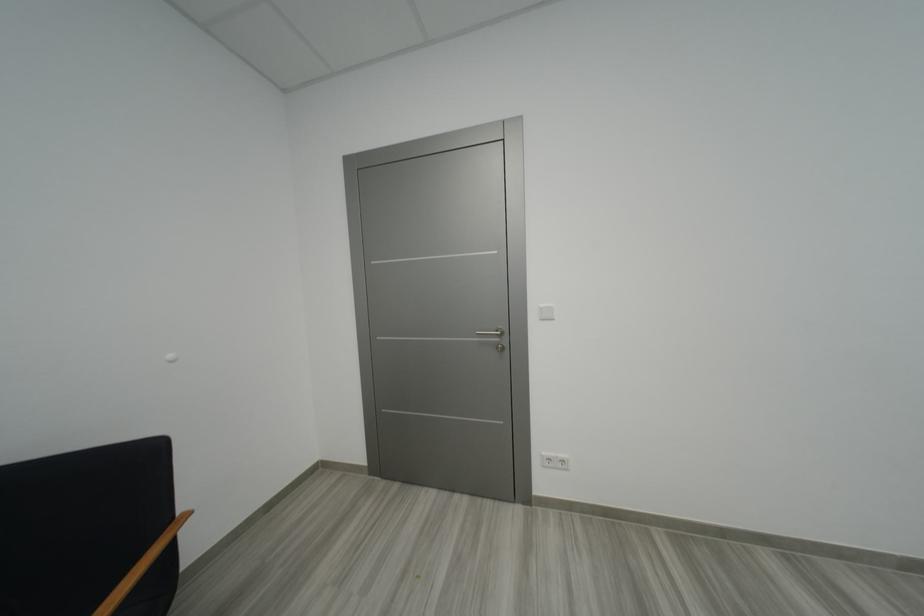
Image resolution: width=924 pixels, height=616 pixels. Identify the location of wooden chair armrest. (162, 543).